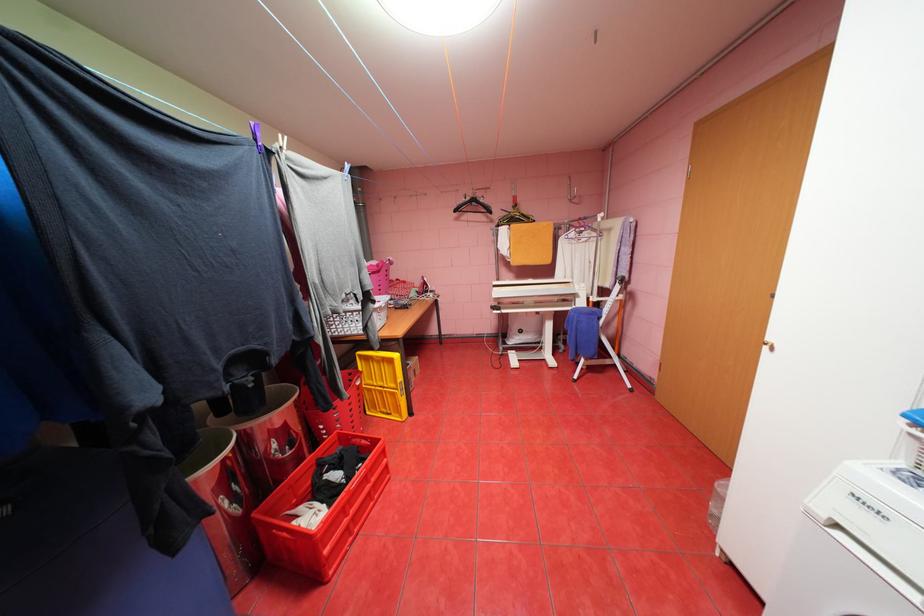
At what (x,y) coordinates should I click in order to perform the action: click on white clothespin. Please return your answer as a coordinate pair (x, y). This screenshot has height=616, width=924. Looking at the image, I should click on (604, 339).